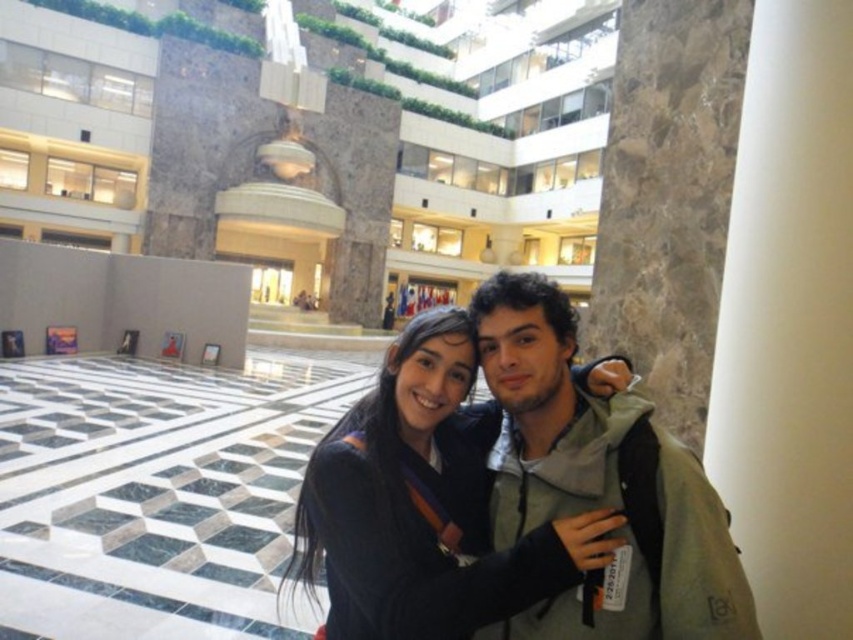
You are a delivery robot with a 6.5 feet wide package. You need to navigate between the gray fabric jacket at center and the dark gray sweater at center. Can you fit through the space between them?

The distance between the gray fabric jacket at center and the dark gray sweater at center is 6.52 feet. Since the package is 6.5 feet wide, it can just barely fit through the space between them.